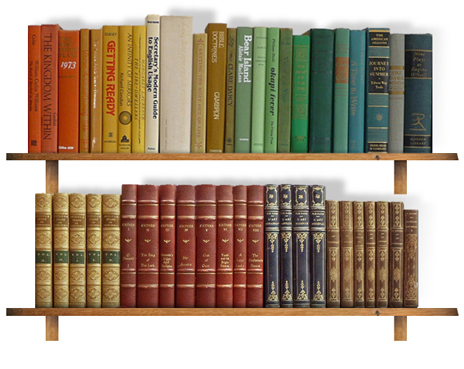
What are the coordinates of `dark red books` in the screenshot? It's located at (129, 237), (150, 231), (165, 235), (184, 232), (201, 231), (224, 230), (238, 230), (254, 230).